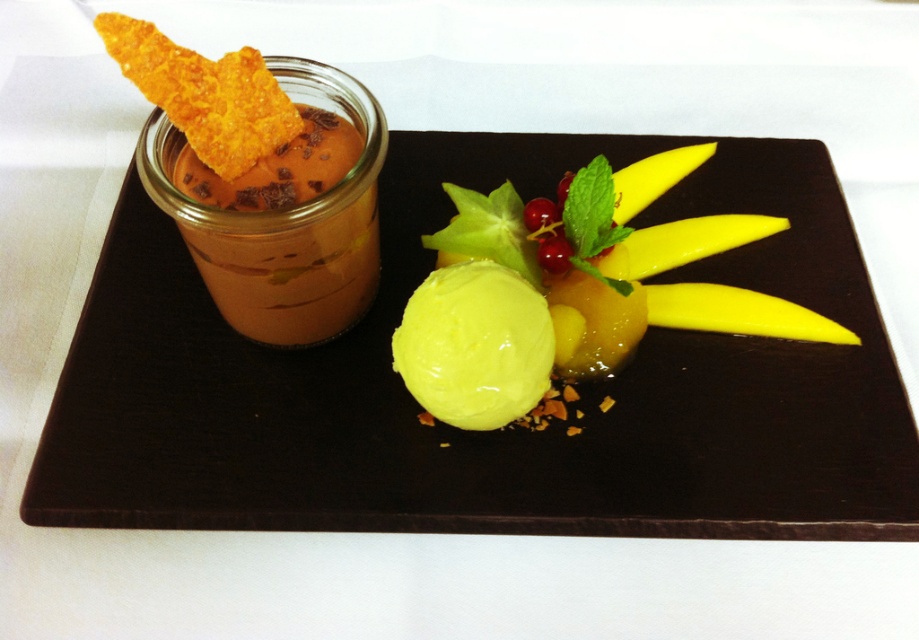
You are a food critic analyzing the dessert plate. You need to describe the spatial arrangement of the matte brown jar at upper left and the yellow glossy ice cream at center. Which object is positioned to the left of the other?

The matte brown jar at upper left is positioned to the left of the yellow glossy ice cream at center.

What are the coordinates of the matte brown jar at upper left on the plate?

The matte brown jar at upper left is located at coordinates point (496,429).